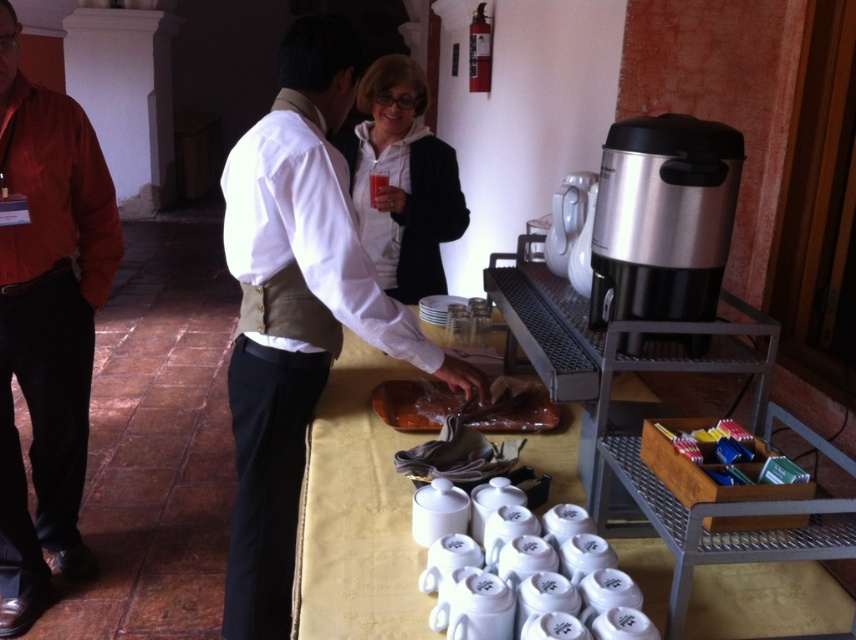
Is silver metallic coffee machine at right further to camera compared to clear plastic cup at center?

No, silver metallic coffee machine at right is in front of clear plastic cup at center.

Between silver metallic coffee machine at right and clear plastic cup at center, which one appears on the right side from the viewer's perspective?

silver metallic coffee machine at right is more to the right.

Is point (736, 163) positioned after point (379, 188)?

No, it is in front of (379, 188).

Find the location of a particular element. Image resolution: width=856 pixels, height=640 pixels. silver metallic coffee machine at right is located at coordinates (663, 218).

Does silver metallic coffee machine at right have a greater width compared to white matte jacket at center?

In fact, silver metallic coffee machine at right might be narrower than white matte jacket at center.

From the picture: Which of these two, silver metallic coffee machine at right or white matte jacket at center, stands shorter?

With less height is silver metallic coffee machine at right.

Is point (623, 212) more distant than point (363, 230)?

No.

Locate an element on the screen. Image resolution: width=856 pixels, height=640 pixels. silver metallic coffee machine at right is located at coordinates (663, 218).

Does matte orange shirt at left appear over clear plastic cup at center?

Actually, matte orange shirt at left is below clear plastic cup at center.

Does point (45, 364) come in front of point (384, 189)?

Yes, it is in front of point (384, 189).

Locate an element on the screen. This screenshot has height=640, width=856. matte orange shirt at left is located at coordinates (46, 324).